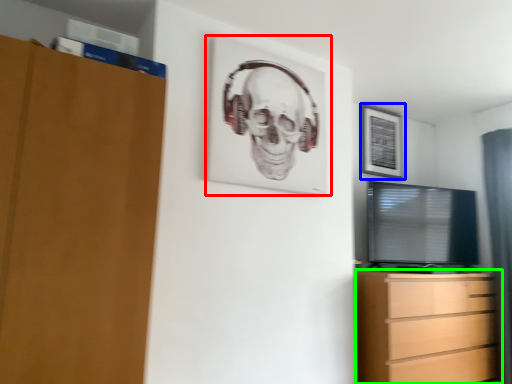
Question: Based on their relative distances, which object is farther from picture frame (highlighted by a red box)? Choose from picture frame (highlighted by a blue box) and chest of drawers (highlighted by a green box).

Choices:
 (A) picture frame
 (B) chest of drawers

Answer: (A)